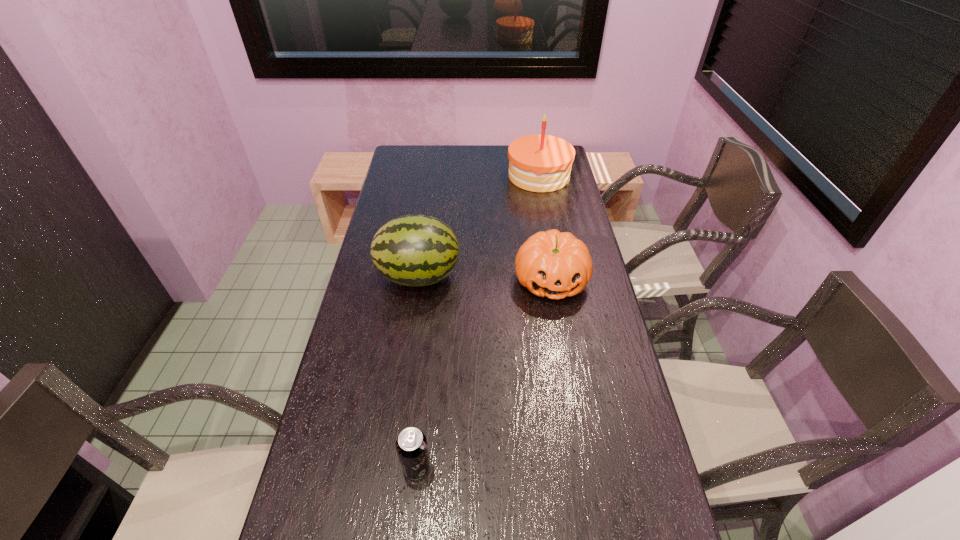
Identify the location of free area in between the nearest object and the watermelon. This screenshot has height=540, width=960. (418, 372).

Locate an element on the screen. This screenshot has height=540, width=960. empty space that is in between the shortest object and the birthday cake is located at coordinates (478, 321).

You are a GUI agent. You are given a task and a screenshot of the screen. Output one action in this format:
    pyautogui.click(x=<x>, y=<y>)
    Task: Click on the vacant space in between the soda can and the watermelon
    Image resolution: width=960 pixels, height=540 pixels.
    Given the screenshot: What is the action you would take?
    click(x=418, y=372)

In order to click on vacant area that lies between the soda can and the pumpkin in this screenshot , I will do `click(484, 374)`.

I want to click on unoccupied position between the soda can and the pumpkin, so click(484, 374).

Locate an element on the screen. object that is the closest to the shortest object is located at coordinates (413, 250).

Where is `object that is the second closest to the third shortest object`? object that is the second closest to the third shortest object is located at coordinates (539, 163).

Where is `free space that satisfies the following two spatial constraints: 1. on the back side of the soda can; 2. on the left side of the tallest object`? The width and height of the screenshot is (960, 540). free space that satisfies the following two spatial constraints: 1. on the back side of the soda can; 2. on the left side of the tallest object is located at coordinates (446, 176).

Where is `vacant space that satisfies the following two spatial constraints: 1. at the stem end of the second tallest object; 2. on the left side of the soda can`? The image size is (960, 540). vacant space that satisfies the following two spatial constraints: 1. at the stem end of the second tallest object; 2. on the left side of the soda can is located at coordinates (392, 467).